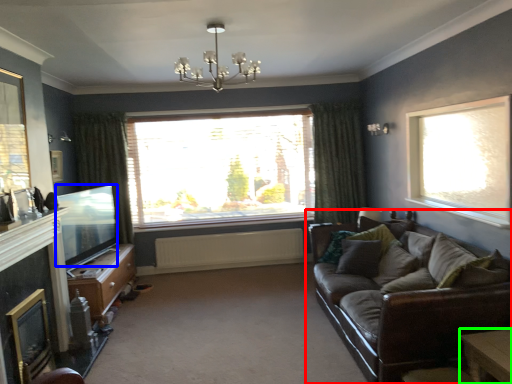
Question: Which is farther away from studio couch (highlighted by a red box)? window screen (highlighted by a blue box) or table (highlighted by a green box)?

Choices:
 (A) window screen
 (B) table

Answer: (A)